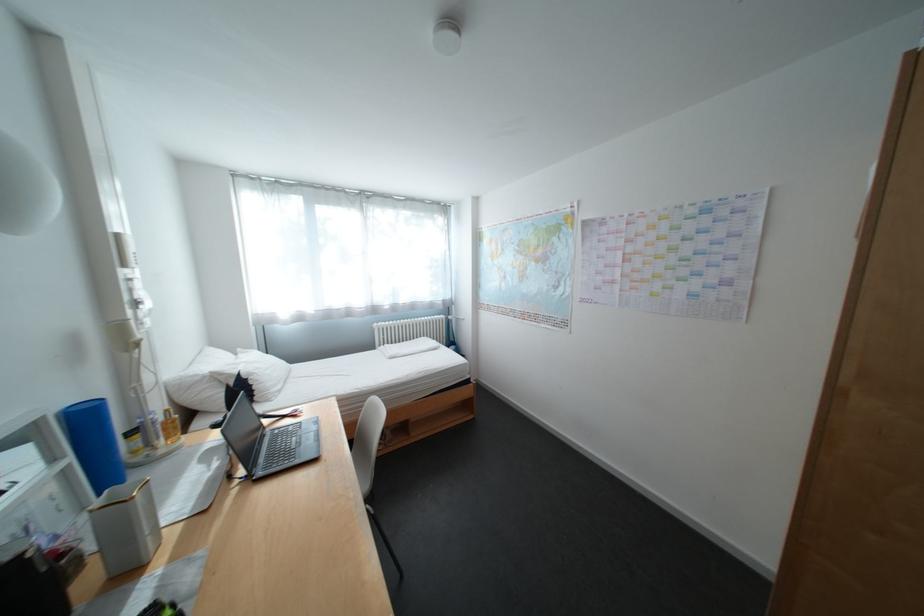
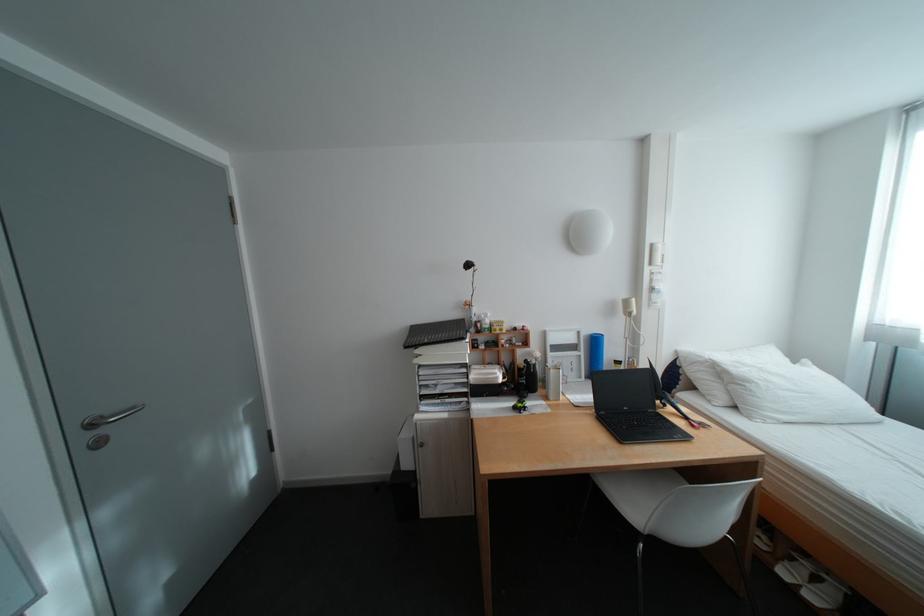
Locate, in the second image, the point that corresponds to (264,376) in the first image.

(761, 384)